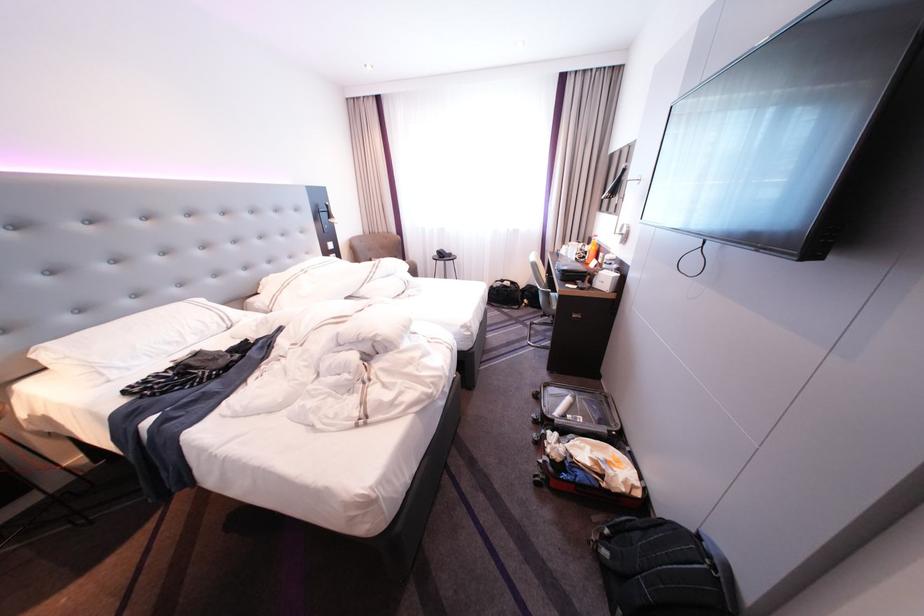
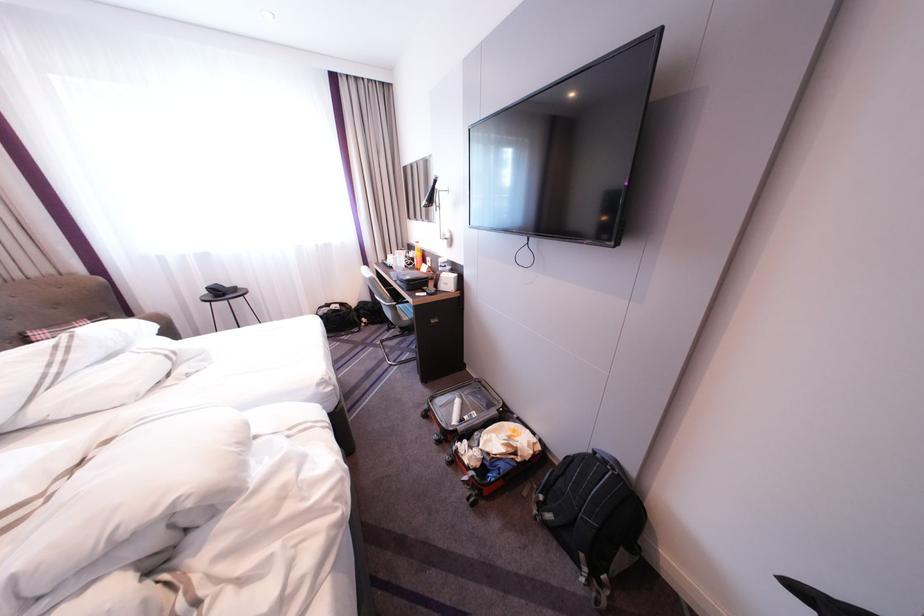
Question: Based on the continuous images, in which direction is the camera rotating? Reply with the corresponding letter.

Choices:
 (A) Left
 (B) Right
 (C) Up
 (D) Down

Answer: (B)